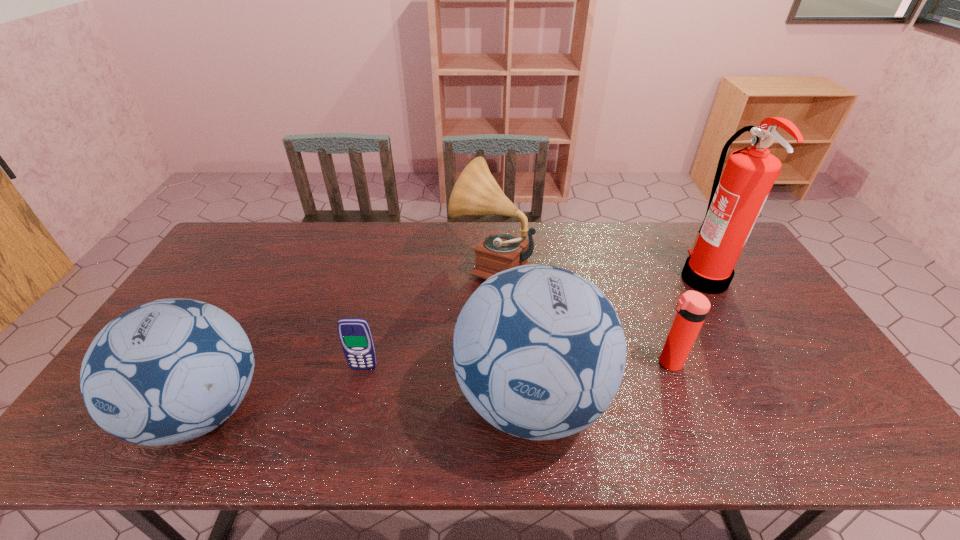
Image resolution: width=960 pixels, height=540 pixels. Find the location of `the shorter soccer ball`. the shorter soccer ball is located at coordinates (171, 370).

Find the location of `the leftmost object`. the leftmost object is located at coordinates (171, 370).

Where is `the right soccer ball`? the right soccer ball is located at coordinates [539, 352].

This screenshot has width=960, height=540. Identify the location of the rightmost object. (735, 203).

Identify the location of fire extinguisher. (735, 203).

Where is `the shortest object`? Image resolution: width=960 pixels, height=540 pixels. the shortest object is located at coordinates (355, 335).

This screenshot has height=540, width=960. I want to click on cellular telephone, so click(x=355, y=335).

The height and width of the screenshot is (540, 960). What are the coordinates of `phonograph record` in the screenshot? It's located at (476, 192).

Identify the location of the fifth object from left to right. The width and height of the screenshot is (960, 540). (692, 308).

You are a GUI agent. You are given a task and a screenshot of the screen. Output one action in this format:
    pyautogui.click(x=<x>, y=<y>)
    Task: Click on the second shortest object
    This screenshot has width=960, height=540.
    Given the screenshot: What is the action you would take?
    [x=692, y=308]